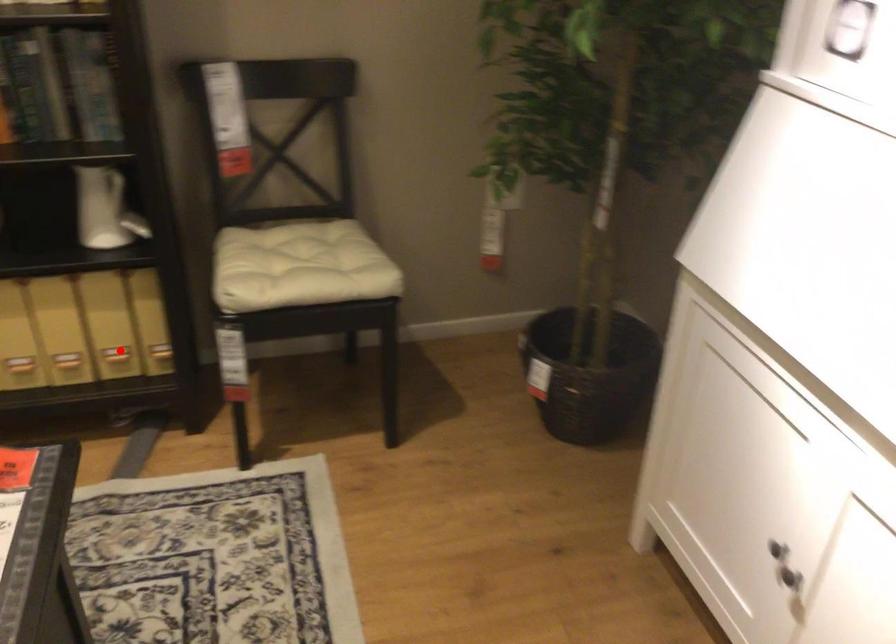
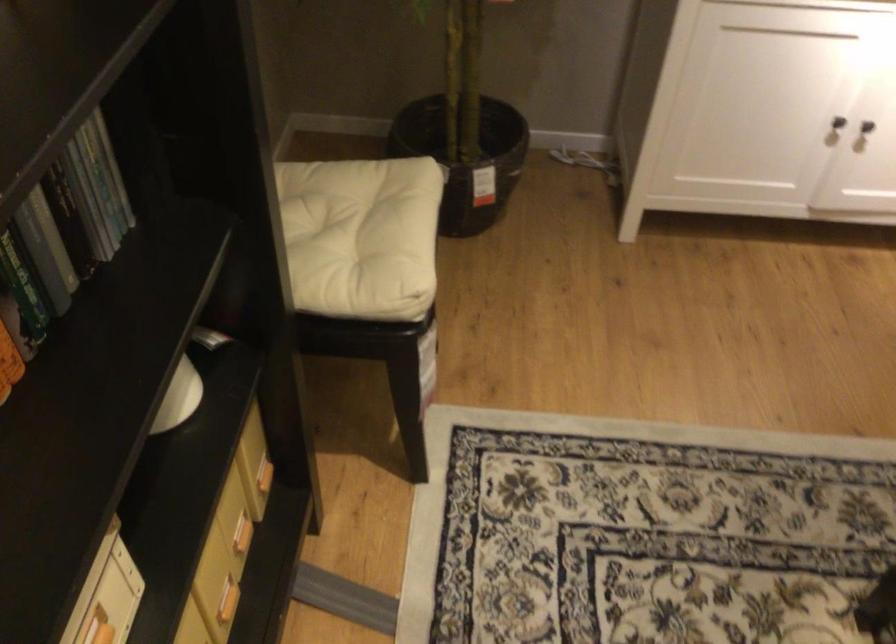
Question: I am providing you with two images of the same scene from different viewpoints. Given a red point in image1, look at the same physical point in image2. Is it:

Choices:
 (A) Closer to the viewpoint
 (B) Farther from the viewpoint

Answer: (A)